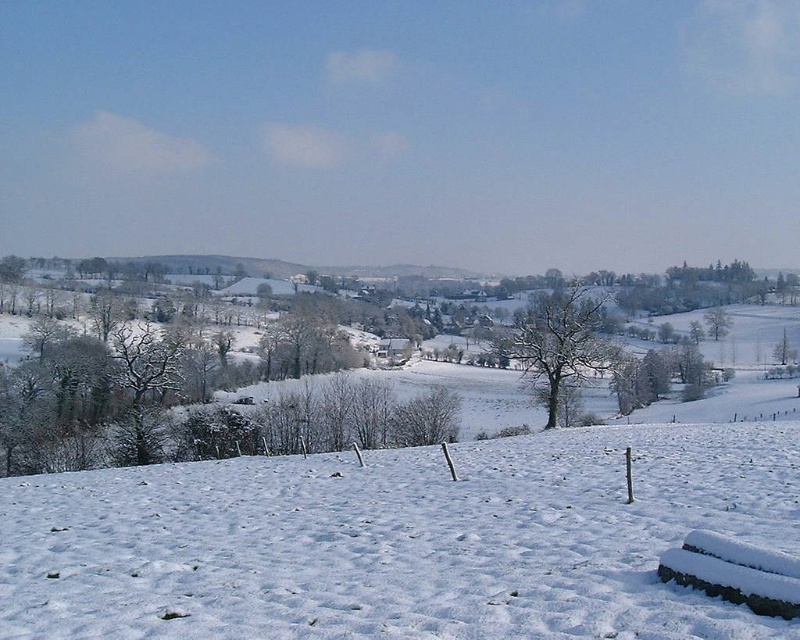
You are standing at the base of the hill in the winter landscape and notice a specific point marked at coordinates point (400, 540). What is the location of the white snow at lower center relative to this point?

The white snow at lower center is located exactly at point (400, 540).